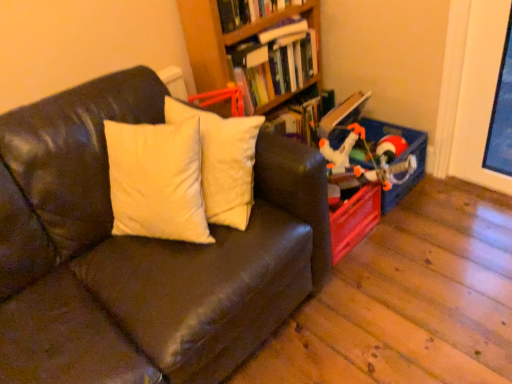
Question: Considering the relative sizes of hardcover book at upper center, the first book when ordered from top to bottom, and wooden bookshelf at upper center in the image provided, is hardcover book at upper center, the first book when ordered from top to bottom, shorter than wooden bookshelf at upper center?

Choices:
 (A) no
 (B) yes

Answer: (B)

Question: Can you confirm if hardcover book at upper center, the first book when ordered from top to bottom, is thinner than wooden bookshelf at upper center?

Choices:
 (A) no
 (B) yes

Answer: (A)

Question: Does hardcover book at upper center, the first book when ordered from top to bottom, contain wooden bookshelf at upper center?

Choices:
 (A) yes
 (B) no

Answer: (B)

Question: Are hardcover book at upper center, the 2th book positioned from the bottom, and wooden bookshelf at upper center beside each other?

Choices:
 (A) no
 (B) yes

Answer: (A)

Question: Considering the relative sizes of hardcover book at upper center, the first book when ordered from top to bottom, and wooden bookshelf at upper center in the image provided, is hardcover book at upper center, the first book when ordered from top to bottom, bigger than wooden bookshelf at upper center?

Choices:
 (A) no
 (B) yes

Answer: (A)

Question: Is hardcover book at upper center, the 2th book positioned from the bottom, wider or thinner than matte plastic toy at right?

Choices:
 (A) thin
 (B) wide

Answer: (B)

Question: Would you say hardcover book at upper center, the 2th book positioned from the bottom, is inside or outside matte plastic toy at right?

Choices:
 (A) inside
 (B) outside

Answer: (B)

Question: Considering the positions of hardcover book at upper center, the 2th book positioned from the bottom, and matte plastic toy at right in the image, is hardcover book at upper center, the 2th book positioned from the bottom, taller or shorter than matte plastic toy at right?

Choices:
 (A) short
 (B) tall

Answer: (A)

Question: Considering their positions, is hardcover book at upper center, the first book when ordered from top to bottom, located in front of or behind matte plastic toy at right?

Choices:
 (A) front
 (B) behind

Answer: (A)

Question: Visually, is leather couch at left positioned to the left or to the right of wooden bookshelf at upper center?

Choices:
 (A) left
 (B) right

Answer: (A)

Question: Is leather couch at left inside the boundaries of wooden bookshelf at upper center, or outside?

Choices:
 (A) inside
 (B) outside

Answer: (B)

Question: Is leather couch at left bigger or smaller than wooden bookshelf at upper center?

Choices:
 (A) small
 (B) big

Answer: (B)

Question: From a real-world perspective, is leather couch at left physically located above or below wooden bookshelf at upper center?

Choices:
 (A) above
 (B) below

Answer: (B)

Question: In terms of size, does leather couch at left appear bigger or smaller than matte plastic toy at right?

Choices:
 (A) small
 (B) big

Answer: (B)

Question: In the image, is leather couch at left on the left side or the right side of matte plastic toy at right?

Choices:
 (A) left
 (B) right

Answer: (A)